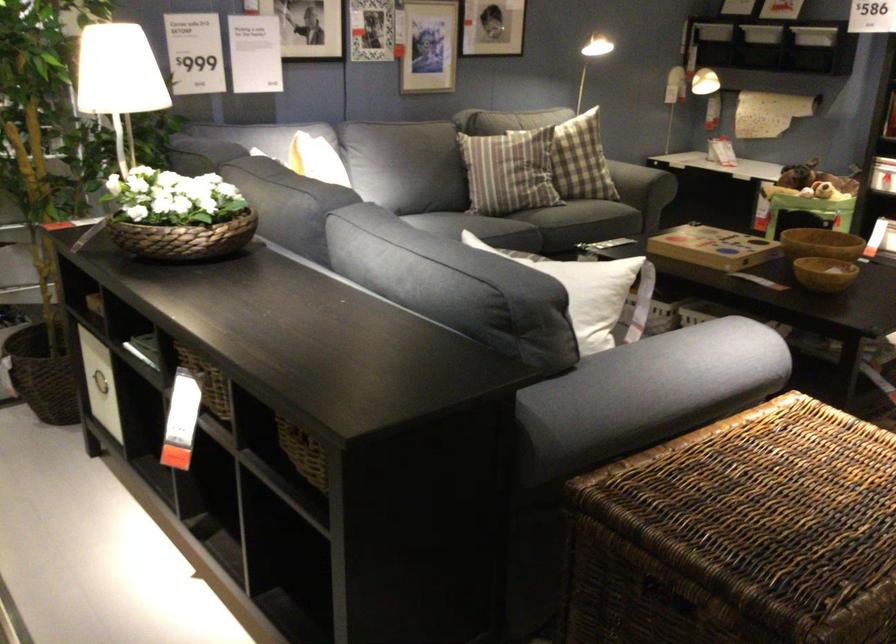
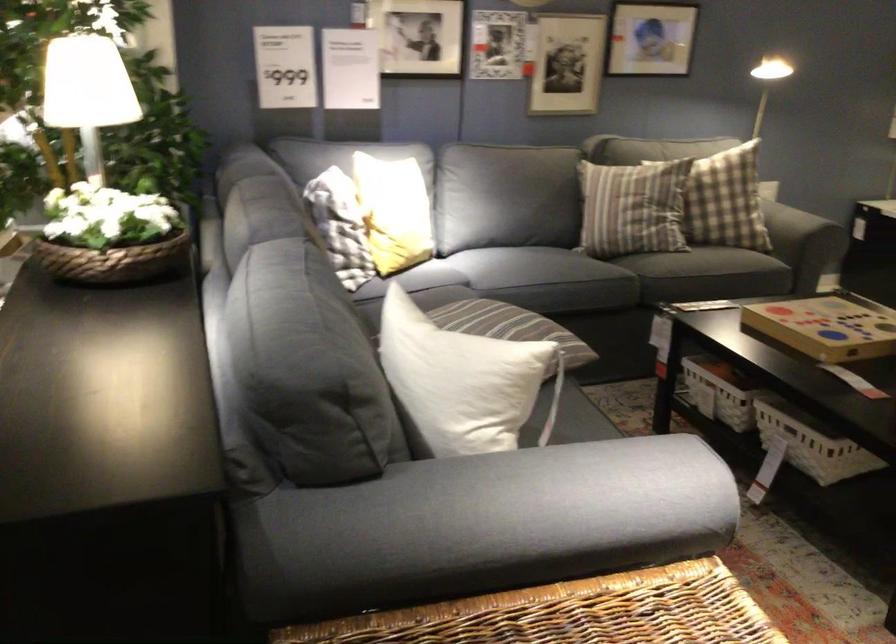
In the second image, find the point that corresponds to [661,185] in the first image.

(798, 223)